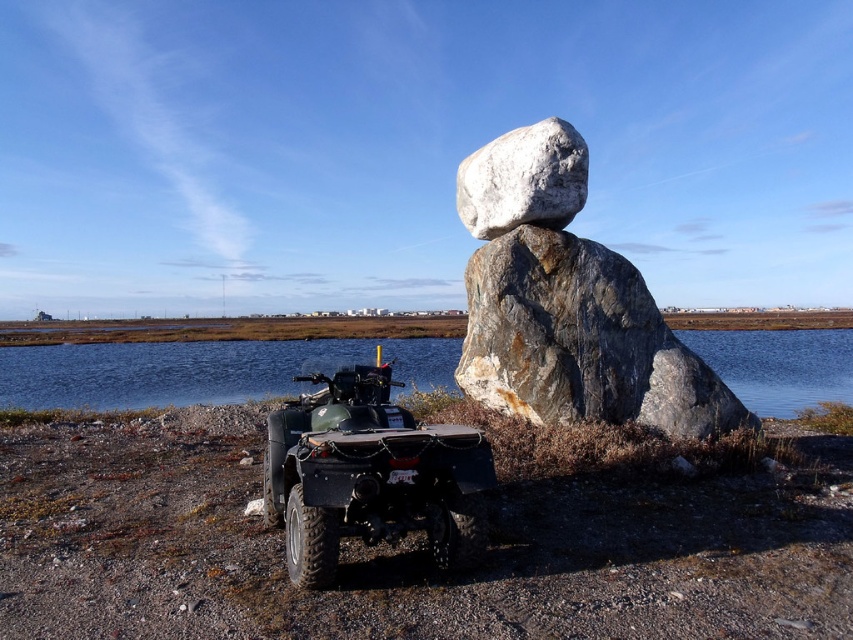
You are a hiker who wants to cross from the left side of the scene to the right side. You see the blue water at center and the white smooth rock at center. Which one should you step on to safely cross?

You should step on the white smooth rock at center because it is behind the blue water at center, meaning it is closer to the right side and provides a stable path.

You are standing at the edge of the scene and want to cross from the left side to the right side. The blue water at center and the white smooth rock at center are in your path. Which object should you step over or around first?

You should step over or around the white smooth rock at center first because the blue water at center is positioned to its right side, meaning the rock is closer to your starting point on the left.

You are planning to cross the blue water at center using the matte black quad bike at lower center. Is the quad bike positioned in a way that allows you to drive directly towards the water?

The matte black quad bike at lower center is to the left of the blue water at center, so it is positioned to the side rather than directly facing the water. You would need to maneuver the quad bike to the right to align it with the blue water at center before driving towards it.